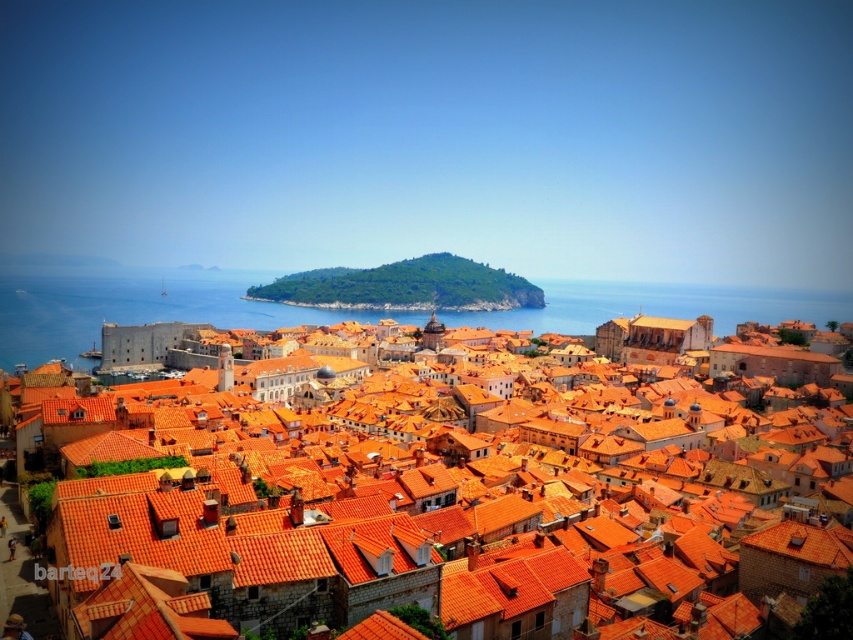
You are standing on a hill overlooking the city and want to take a photo that includes both the orange clay rooftops at center and the blue water at center. Which object should you position closer to the left side of your camera frame?

The orange clay rooftops at center should be positioned closer to the left side of your camera frame since it is located to the left of the blue water at center in the scene.